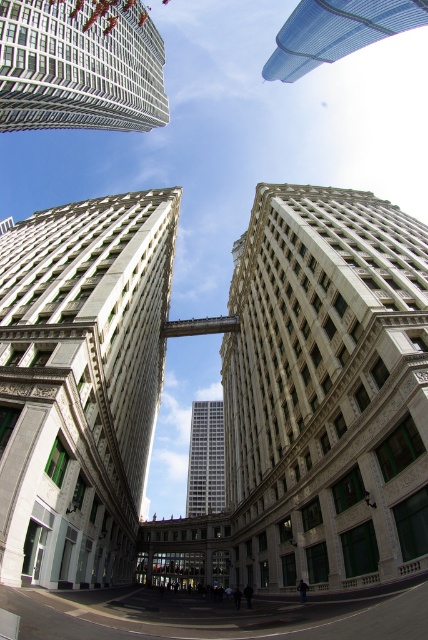
You are a city planner assessing the potential for a new rooftop garden. You observe the white marble building at center and the transparent glass skyscraper at upper center. Which of these two buildings would be more suitable for installing a rooftop garden based on their height?

The white marble building at center is much taller than the transparent glass skyscraper at upper center, making it more suitable for a rooftop garden since taller buildings typically have larger roof areas that can accommodate such installations.

You are standing in the urban scene looking up at the buildings. There are two points marked in the image, one at coordinates point (11, 474) and another at point (359, 8). Which of these points is nearer to your current position?

Point (11, 474) is closer to the viewer than point (359, 8).

You are standing in the urban scene looking up at the buildings. There is a point marked at coordinates (80, 381). Which building is located at that point?

The white marble building at center is located at point (80, 381).